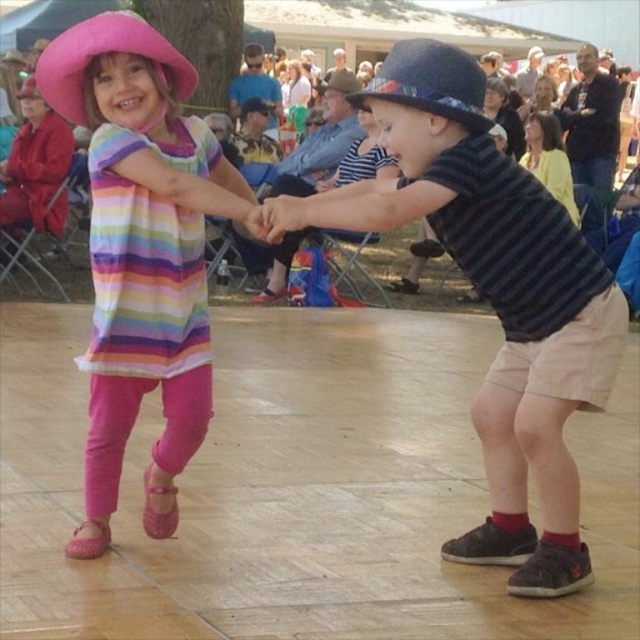
You are a photographer trying to capture the best shot of the two points in the scene. Which point, point 1 at coordinates point (196, 228) or point 2 at coordinates point (33, 80), is closer to your camera lens?

Point 1 at coordinates point (196, 228) is closer to the camera lens than point 2 at coordinates point (33, 80).

You are a photographer at the event and want to take a group photo of the velvet blue hat at upper center and the pink fabric hat at upper left. Which hat should you position closer to the camera to ensure both hats appear the same size in the photo?

The velvet blue hat at upper center is smaller in size compared to the pink fabric hat at upper left. To make them appear the same size in the photo, position the smaller velvet blue hat at upper center closer to the camera while keeping the larger pink fabric hat at upper left farther back.

You are taking a photo of the two points in the image. Which point, point (x=506, y=497) or point (x=36, y=67), will appear larger in your photo?

Point (x=506, y=497) is closer to the camera than point (x=36, y=67), so it will appear larger in the photo.